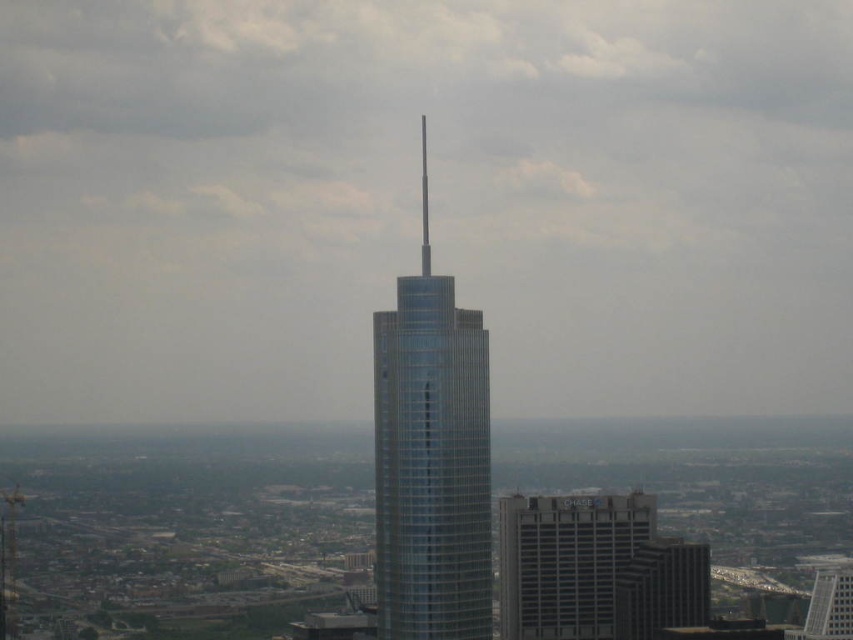
Question: In this image, where is glassy silver tower at center located relative to glassy silver skyscraper at lower right?

Choices:
 (A) below
 (B) above

Answer: (B)

Question: Considering the real-world distances, which object is closest to the glassy silver tower at center?

Choices:
 (A) gray concrete building at lower center
 (B) glassy silver skyscraper at lower right

Answer: (A)

Question: Considering the real-world distances, which object is closest to the glassy silver tower at center?

Choices:
 (A) gray concrete building at lower center
 (B) glassy silver skyscraper at lower right

Answer: (A)

Question: Does gray concrete building at lower center have a larger size compared to glassy silver skyscraper at lower right?

Choices:
 (A) no
 (B) yes

Answer: (B)

Question: Is glassy silver tower at center further to camera compared to glassy silver skyscraper at lower right?

Choices:
 (A) no
 (B) yes

Answer: (A)

Question: Estimate the real-world distances between objects in this image. Which object is closer to the gray concrete building at lower center?

Choices:
 (A) glassy silver skyscraper at lower right
 (B) glassy silver tower at center

Answer: (A)